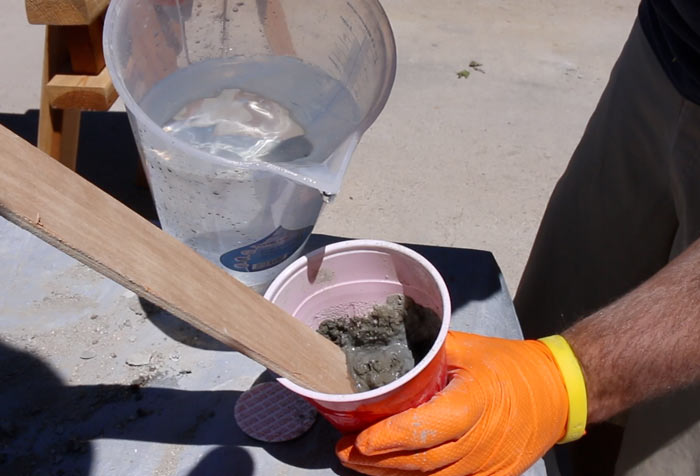
Locate an element on the screen. concrete floor is located at coordinates (512, 114).